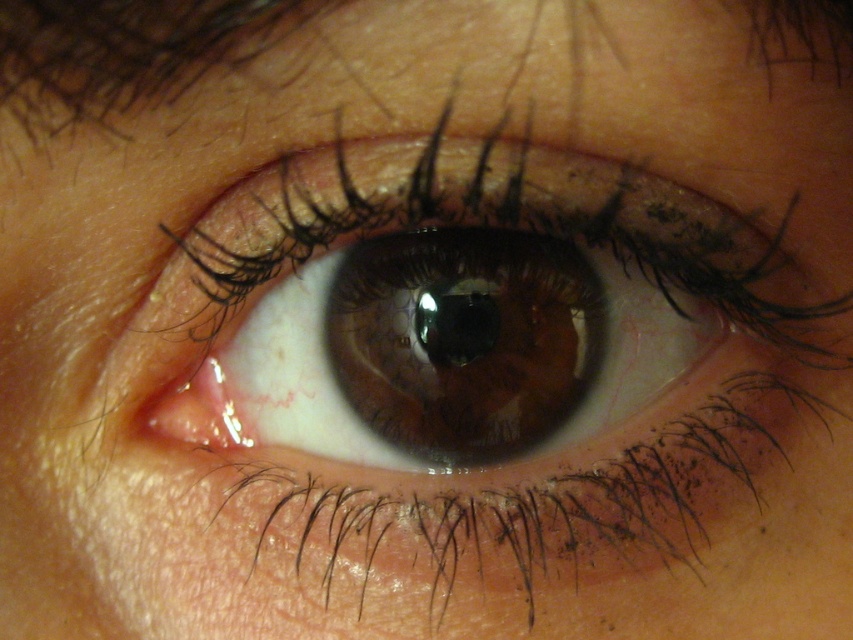
Question: Which of the following is the closest to the observer?

Choices:
 (A) brown glossy eye at center
 (B) brown hair at upper left

Answer: (B)

Question: Is brown glossy eye at center wider than brown hair at upper left?

Choices:
 (A) no
 (B) yes

Answer: (B)

Question: Is brown glossy eye at center positioned at the back of brown hair at upper left?

Choices:
 (A) no
 (B) yes

Answer: (B)

Question: Where is brown glossy eye at center located in relation to brown hair at upper left in the image?

Choices:
 (A) right
 (B) left

Answer: (A)

Question: Among these objects, which one is farthest from the camera?

Choices:
 (A) brown hair at upper left
 (B) brown glossy eye at center

Answer: (B)